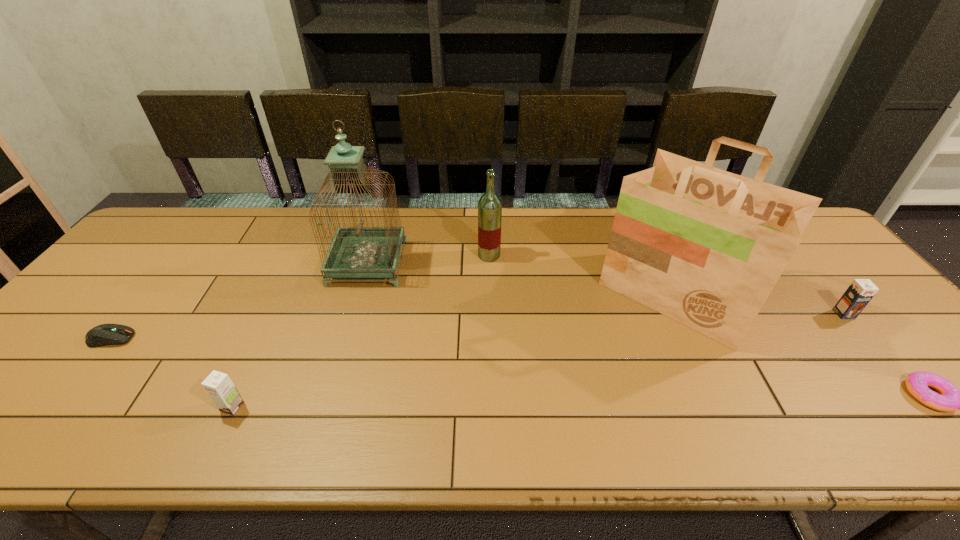
The image size is (960, 540). Find the location of `birdcage`. birdcage is located at coordinates (355, 252).

I want to click on the fifth object from left to right, so click(x=705, y=247).

You are a GUI agent. You are given a task and a screenshot of the screen. Output one action in this format:
    pyautogui.click(x=<x>, y=<y>)
    Task: Click on the liquor
    This screenshot has height=540, width=960.
    Given the screenshot: What is the action you would take?
    pyautogui.click(x=490, y=205)

At what (x,y) coordinates should I click in order to perform the action: click on the fifth shortest object. Please return your answer as a coordinate pair (x, y). This screenshot has width=960, height=540. Looking at the image, I should click on (490, 205).

This screenshot has width=960, height=540. What are the coordinates of `the right chocolate milk` in the screenshot? It's located at (860, 292).

Identify the location of the nearer chocolate milk. The image size is (960, 540). (218, 385).

Where is `the left chocolate milk`? The height and width of the screenshot is (540, 960). the left chocolate milk is located at coordinates click(218, 385).

The height and width of the screenshot is (540, 960). I want to click on computer equipment, so click(x=105, y=334).

Locate an element on the screen. vacant space located 0.180m at the door of the third object from left to right is located at coordinates pos(464,263).

At what (x,y) coordinates should I click in order to perform the action: click on blank area located 0.270m on the right of the grocery bag. Please return your answer as a coordinate pair (x, y). The height and width of the screenshot is (540, 960). Looking at the image, I should click on (850, 295).